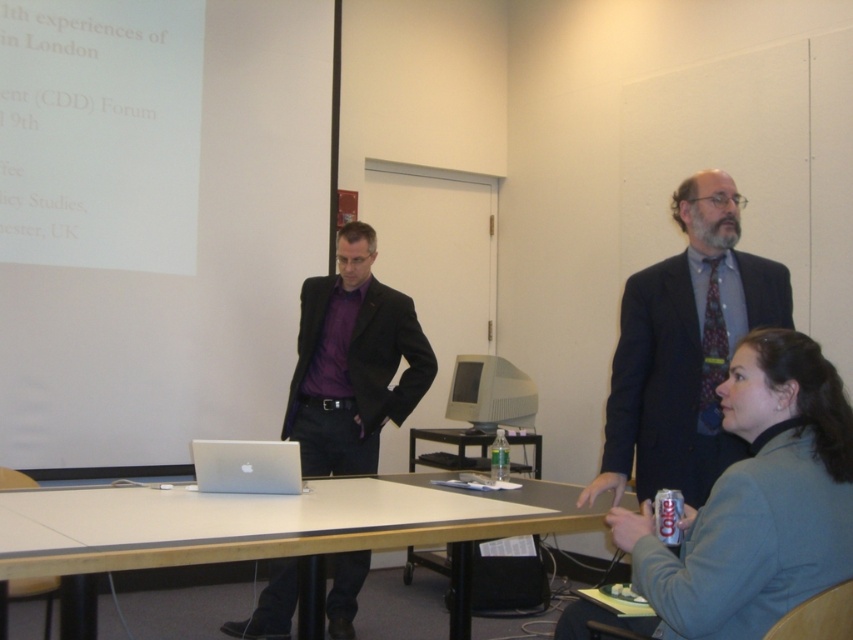
You are a person who is 1.8 meters tall. You are standing in front of the light brown wooden table at center. Can you comfortably rest your hands on the table without bending over?

The light brown wooden table at center is 1.60 meters away from the viewer. Since the average comfortable reaching distance for someone of your height is around 1.5 meters, you might need to take a small step forward to comfortably rest your hands on the table without bending over.

You are organizing a presentation in the conference room. You need to place a large projector on the table. The projector is wider than the silver metallic laptop at center. Can the projector fit on the light brown wooden table at center if it is placed to the right of the laptop?

The light brown wooden table at center is to the right of the silver metallic laptop at center, so placing the projector to the right of the laptop would utilize the available space. Since the table is at the center and the laptop is positioned to the left of it, there should be enough space for the projector provided it doesn

You are standing in the conference room and want to find the matte black suit at center. Where is it located in terms of coordinates?

The matte black suit at center is located at coordinates point (352,362).